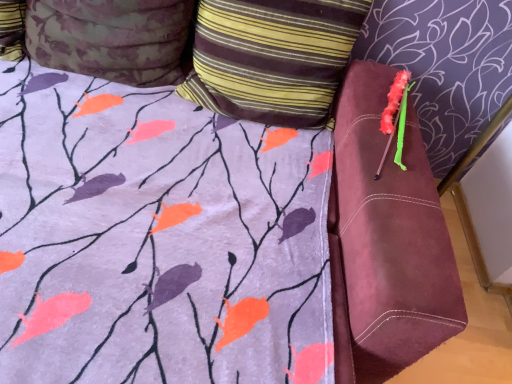
Question: Considering the relative sizes of fluffy pink brush at upper right and floral fabric pillow at upper left, arranged as the 1th pillow when viewed from the left, in the image provided, is fluffy pink brush at upper right shorter than floral fabric pillow at upper left, arranged as the 1th pillow when viewed from the left,?

Choices:
 (A) no
 (B) yes

Answer: (B)

Question: Considering the relative positions of fluffy pink brush at upper right and floral fabric pillow at upper left, arranged as the 1th pillow when viewed from the left, in the image provided, is fluffy pink brush at upper right in front of floral fabric pillow at upper left, arranged as the 1th pillow when viewed from the left,?

Choices:
 (A) no
 (B) yes

Answer: (A)

Question: Can you confirm if fluffy pink brush at upper right is taller than floral fabric pillow at upper left, arranged as the 1th pillow when viewed from the left?

Choices:
 (A) yes
 (B) no

Answer: (B)

Question: From a real-world perspective, is fluffy pink brush at upper right below floral fabric pillow at upper left, which is the second pillow in right-to-left order?

Choices:
 (A) no
 (B) yes

Answer: (B)

Question: Is fluffy pink brush at upper right oriented towards floral fabric pillow at upper left, which is the second pillow in right-to-left order?

Choices:
 (A) no
 (B) yes

Answer: (A)

Question: From a real-world perspective, is striped fabric pillow at upper center, arranged as the second pillow when viewed from the left, positioned above or below floral fabric pillow at upper left, arranged as the 1th pillow when viewed from the left?

Choices:
 (A) below
 (B) above

Answer: (B)

Question: Is striped fabric pillow at upper center, arranged as the second pillow when viewed from the left, situated inside floral fabric pillow at upper left, which is the second pillow in right-to-left order, or outside?

Choices:
 (A) outside
 (B) inside

Answer: (A)

Question: From their relative heights in the image, would you say striped fabric pillow at upper center, marked as the first pillow in a right-to-left arrangement, is taller or shorter than floral fabric pillow at upper left, which is the second pillow in right-to-left order?

Choices:
 (A) tall
 (B) short

Answer: (A)

Question: In the image, is striped fabric pillow at upper center, arranged as the second pillow when viewed from the left, positioned in front of or behind floral fabric pillow at upper left, arranged as the 1th pillow when viewed from the left?

Choices:
 (A) behind
 (B) front

Answer: (A)

Question: From the image's perspective, is floral fabric pillow at upper left, arranged as the 1th pillow when viewed from the left, located above or below striped fabric pillow at upper center, arranged as the second pillow when viewed from the left?

Choices:
 (A) above
 (B) below

Answer: (A)

Question: Is point (79, 67) closer or farther from the camera than point (322, 33)?

Choices:
 (A) closer
 (B) farther

Answer: (A)

Question: In the image, is floral fabric pillow at upper left, which is the second pillow in right-to-left order, positioned in front of or behind striped fabric pillow at upper center, marked as the first pillow in a right-to-left arrangement?

Choices:
 (A) front
 (B) behind

Answer: (A)

Question: Considering the positions of floral fabric pillow at upper left, which is the second pillow in right-to-left order, and striped fabric pillow at upper center, marked as the first pillow in a right-to-left arrangement, in the image, is floral fabric pillow at upper left, which is the second pillow in right-to-left order, bigger or smaller than striped fabric pillow at upper center, marked as the first pillow in a right-to-left arrangement,?

Choices:
 (A) small
 (B) big

Answer: (A)

Question: Looking at their shapes, would you say fluffy pink brush at upper right is wider or thinner than striped fabric pillow at upper center, marked as the first pillow in a right-to-left arrangement?

Choices:
 (A) thin
 (B) wide

Answer: (B)

Question: Relative to striped fabric pillow at upper center, marked as the first pillow in a right-to-left arrangement, is fluffy pink brush at upper right in front or behind?

Choices:
 (A) front
 (B) behind

Answer: (B)